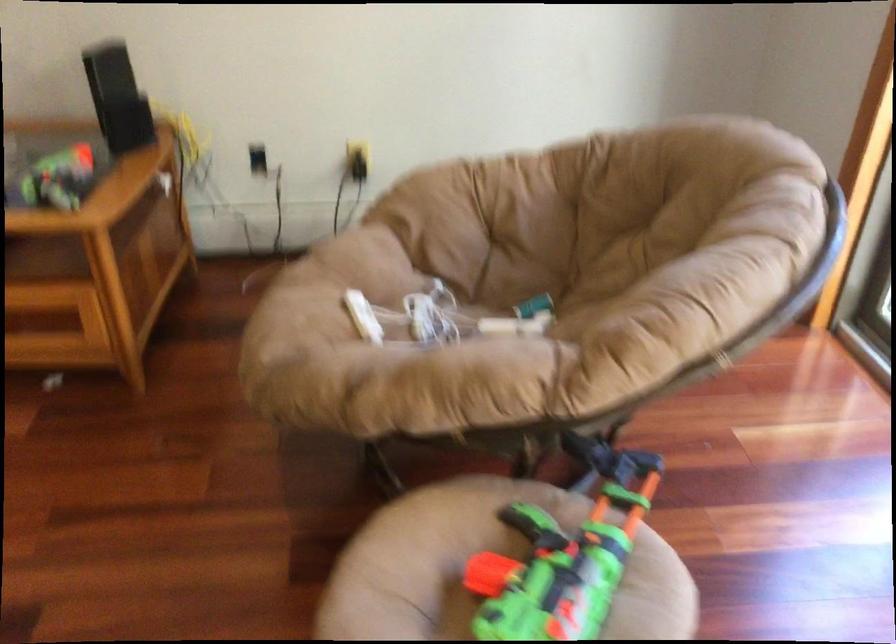
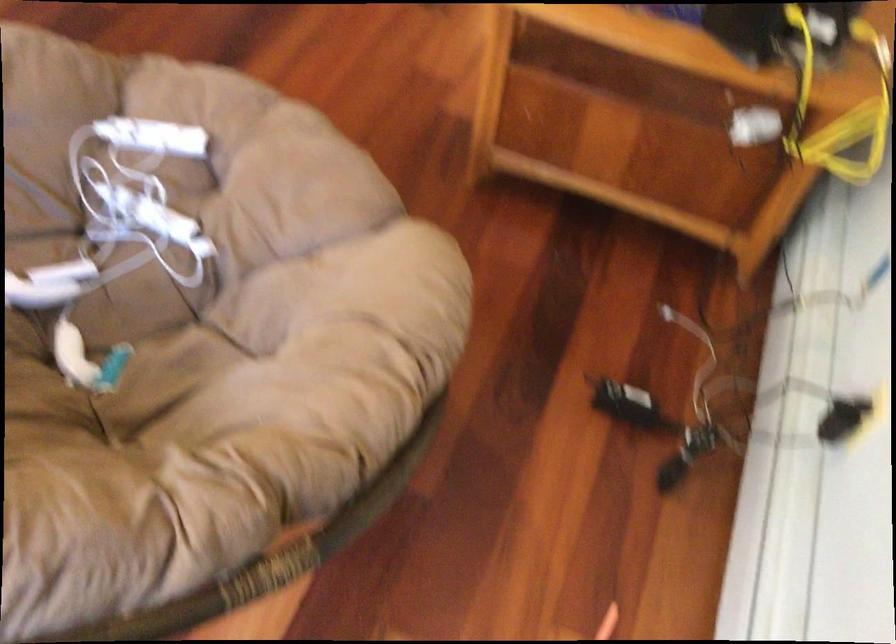
The point at (x=362, y=315) is marked in the first image. Where is the corresponding point in the second image?

(152, 137)